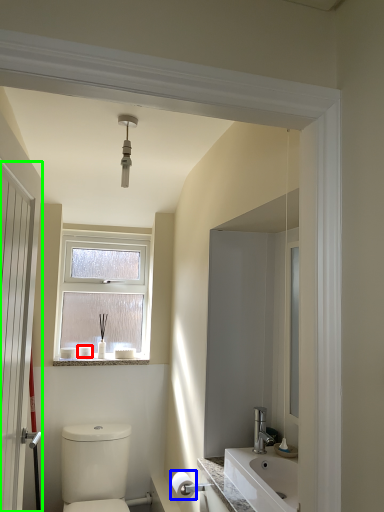
Question: Considering the real-world distances, which object is closest to toiletry (highlighted by a red box)? toilet paper (highlighted by a blue box) or door (highlighted by a green box).

Choices:
 (A) toilet paper
 (B) door

Answer: (A)